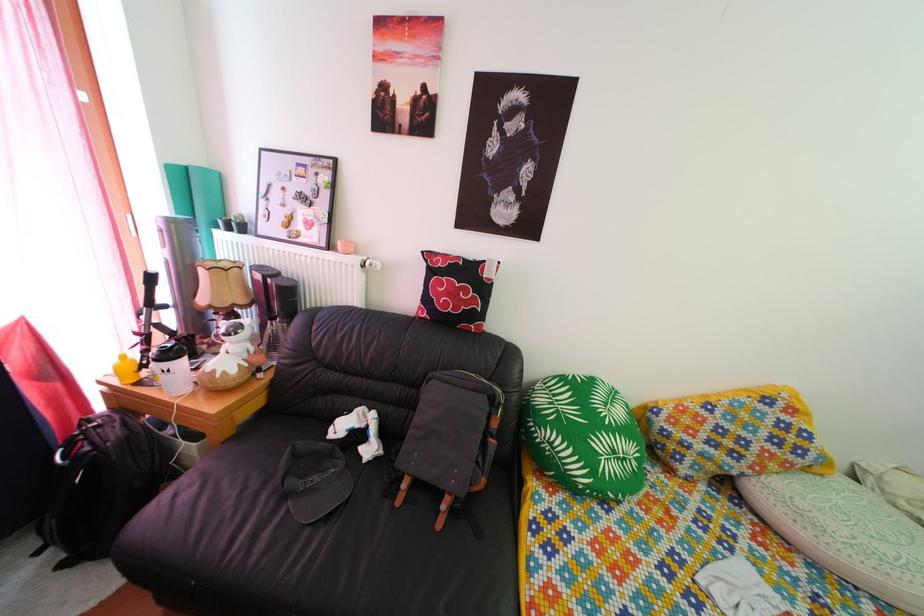
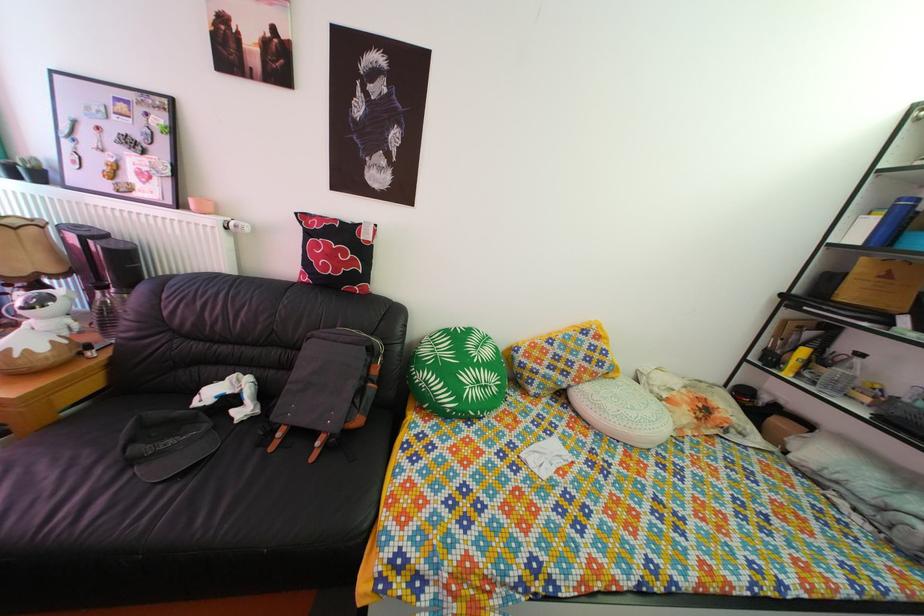
In the second image, find the point that corresponds to (460,301) in the first image.

(338, 264)